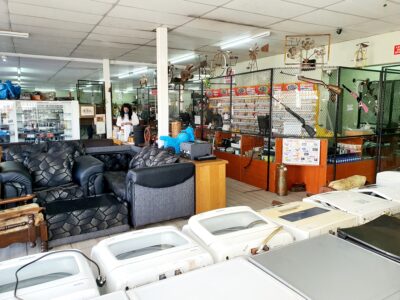
At what (x,y) coordinates should I click in order to perform the action: click on dryers. Please return your answer as a coordinate pair (x, y). Looking at the image, I should click on (120, 296), (198, 289), (350, 267), (392, 238).